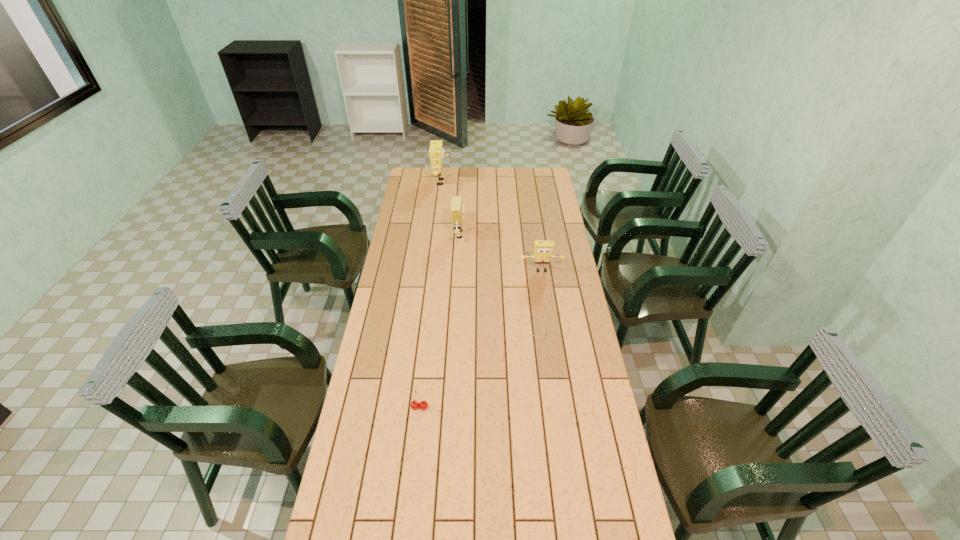
Where is `vacant space located 0.330m on the face of the third farthest object`? Image resolution: width=960 pixels, height=540 pixels. vacant space located 0.330m on the face of the third farthest object is located at coordinates (550, 330).

Where is `vacant space located 0.300m with the stems of the shortest object pointing upwards`? Image resolution: width=960 pixels, height=540 pixels. vacant space located 0.300m with the stems of the shortest object pointing upwards is located at coordinates (409, 502).

Identify the location of object that is at the far edge. The image size is (960, 540). (436, 152).

At what (x,y) coordinates should I click in order to perform the action: click on object located at the left edge. Please return your answer as a coordinate pair (x, y). The height and width of the screenshot is (540, 960). Looking at the image, I should click on (436, 152).

Identify the location of object present at the right edge. (543, 250).

The image size is (960, 540). Find the location of `object present at the far left corner`. object present at the far left corner is located at coordinates (436, 152).

In the image, there is a desktop. At what (x,y) coordinates should I click in order to perform the action: click on vacant region at the far edge. Please return your answer as a coordinate pair (x, y). The width and height of the screenshot is (960, 540). Looking at the image, I should click on (504, 178).

Locate an element on the screen. This screenshot has width=960, height=540. free space at the left edge is located at coordinates (356, 413).

Identify the location of free space at the right edge. Image resolution: width=960 pixels, height=540 pixels. (533, 188).

The height and width of the screenshot is (540, 960). In the image, there is a desktop. Identify the location of vacant space at the far right corner. (527, 171).